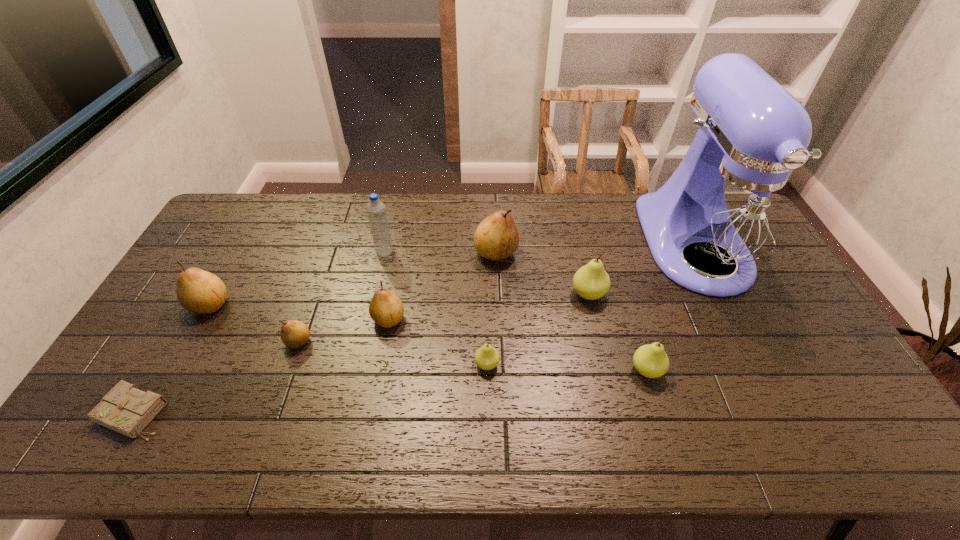
Image resolution: width=960 pixels, height=540 pixels. What are the coordinates of `vacant area situated 0.270m on the back of the tallest pear` in the screenshot? It's located at (493, 194).

The width and height of the screenshot is (960, 540). What are the coordinates of `free space located on the left of the eighth object from left to right` in the screenshot? It's located at (544, 294).

Locate an element on the screen. Image resolution: width=960 pixels, height=540 pixels. vacant space located on the front of the leftmost pear is located at coordinates (174, 370).

In order to click on free space located 0.220m on the left of the second smallest green pear in this screenshot , I will do `click(547, 370)`.

Where is `vacant space situated 0.280m on the right of the third brown pear from left to right`? The height and width of the screenshot is (540, 960). vacant space situated 0.280m on the right of the third brown pear from left to right is located at coordinates [501, 319].

Where is `blank space located 0.080m on the left of the leftmost green pear`? blank space located 0.080m on the left of the leftmost green pear is located at coordinates (445, 364).

You are a GUI agent. You are given a task and a screenshot of the screen. Output one action in this format:
    pyautogui.click(x=<x>, y=<y>)
    Task: Click on the vacant space located 0.190m on the back of the smallest brown pear
    This screenshot has width=960, height=540.
    Given the screenshot: What is the action you would take?
    pyautogui.click(x=319, y=283)

The image size is (960, 540). I want to click on vacant region located on the back of the shortest object, so click(x=188, y=320).

I want to click on object present at the far edge, so click(x=732, y=206).

Identify the location of object at the near edge. (126, 409).